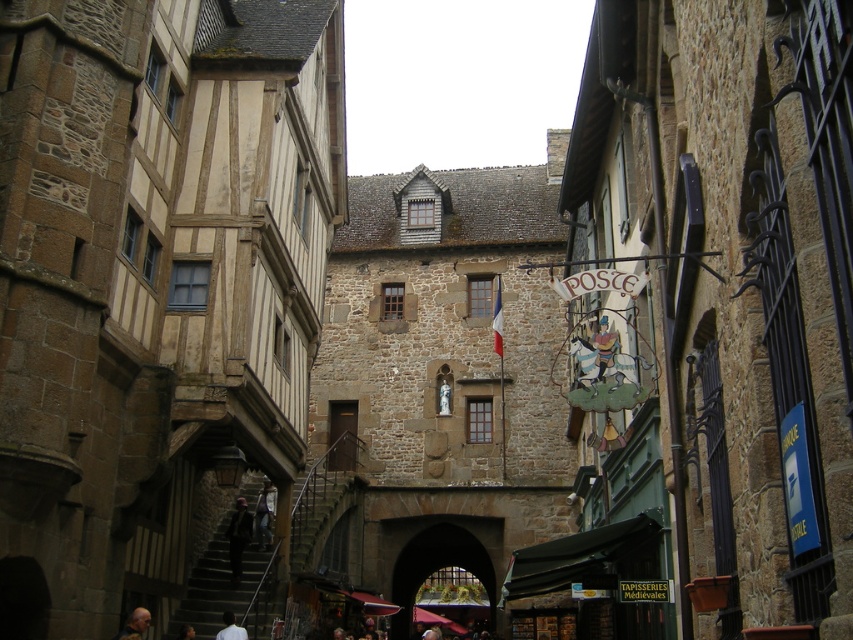
Is point (241, 532) positioned in front of point (143, 620)?

No, it is behind (143, 620).

Who is more forward, (245, 508) or (126, 634)?

Positioned in front is point (126, 634).

Is point (245, 518) positioned behind point (128, 625)?

Yes, point (245, 518) is behind point (128, 625).

Where is `dark gray fabric jacket at lower center`? This screenshot has height=640, width=853. dark gray fabric jacket at lower center is located at coordinates (238, 536).

Between point (148, 618) and point (225, 637), which one is positioned in front?

Point (148, 618) is in front.

Who is more forward, (144, 630) or (221, 637)?

Point (144, 630)

This screenshot has height=640, width=853. Identify the location of brown leather jacket at lower center. (135, 625).

Is dark gray fabric jacket at lower center to the left of white shirt at lower center from the viewer's perspective?

Yes, dark gray fabric jacket at lower center is to the left of white shirt at lower center.

Is dark gray fabric jacket at lower center closer to the viewer compared to white shirt at lower center?

No.

Which is behind, point (225, 531) or point (222, 636)?

The point (225, 531) is behind.

Locate an element on the screen. dark gray fabric jacket at lower center is located at coordinates (238, 536).